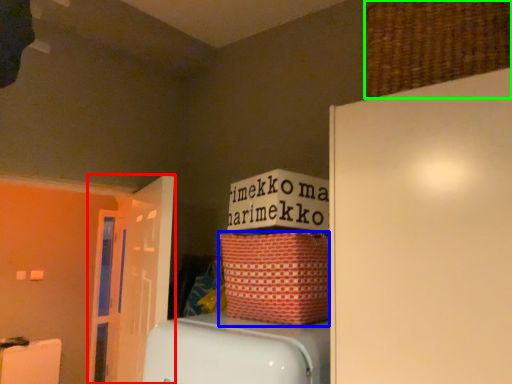
Question: Considering the real-world distances, which object is closest to door (highlighted by a red box)? basket (highlighted by a blue box) or basket (highlighted by a green box).

Choices:
 (A) basket
 (B) basket

Answer: (A)